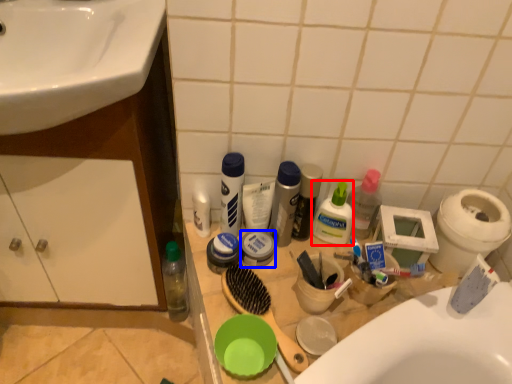
Question: Among these objects, which one is nearest to the camera, toiletry (highlighted by a red box) or toiletry (highlighted by a blue box)?

Choices:
 (A) toiletry
 (B) toiletry

Answer: (A)